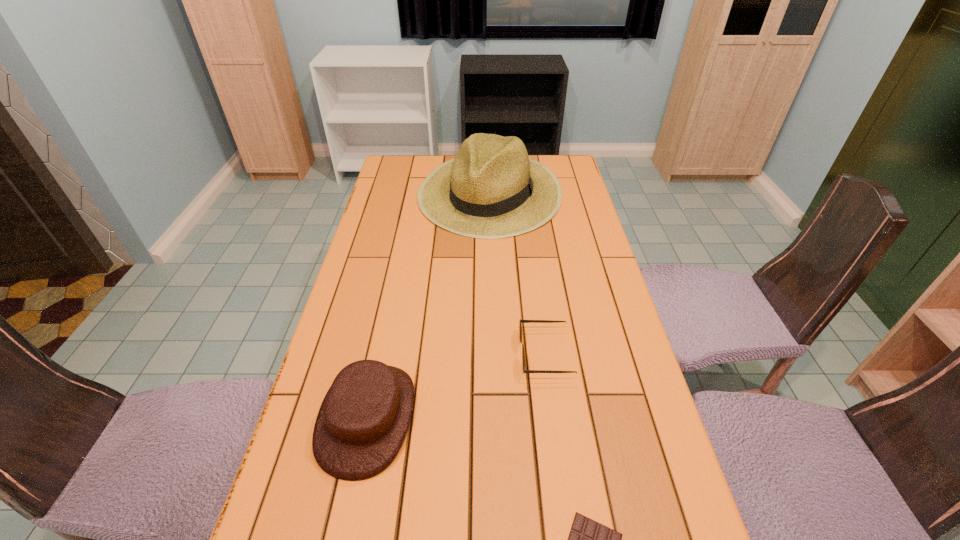
Where is `sunhat at the left edge`? sunhat at the left edge is located at coordinates (491, 189).

At what (x,y) coordinates should I click in order to perform the action: click on hat at the left edge. Please return your answer as a coordinate pair (x, y). The image size is (960, 540). Looking at the image, I should click on point(363,420).

Where is `sunhat that is at the right edge`? sunhat that is at the right edge is located at coordinates coord(491,189).

Identify the location of sunglasses that is at the right edge. Image resolution: width=960 pixels, height=540 pixels. (521, 321).

Identify the location of object at the far left corner. This screenshot has width=960, height=540. (491, 189).

The width and height of the screenshot is (960, 540). Find the location of `object situated at the far right corner`. object situated at the far right corner is located at coordinates (491, 189).

The height and width of the screenshot is (540, 960). What are the coordinates of `free space at the left edge of the desktop` in the screenshot? It's located at (399, 242).

Find the location of a particular element. This screenshot has height=540, width=960. vacant space at the right edge of the desktop is located at coordinates [610, 351].

Find the location of a particular element. vacant area at the far right corner of the desktop is located at coordinates (540, 159).

This screenshot has width=960, height=540. In order to click on free point between the second tallest object and the sunglasses in this screenshot , I will do `click(457, 386)`.